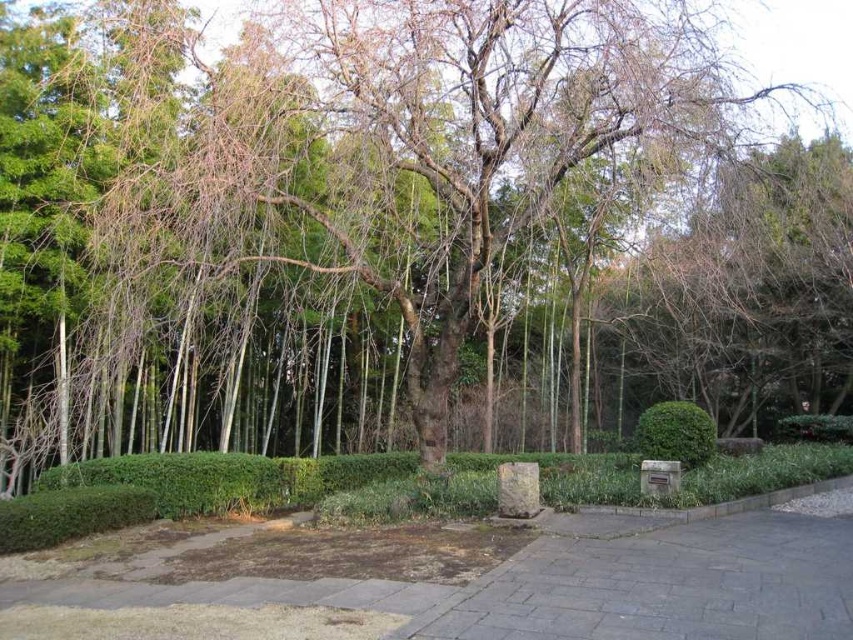
Question: Can you confirm if gray stone pavement at lower center is positioned to the right of green matte bush at center?

Choices:
 (A) no
 (B) yes

Answer: (A)

Question: Among these objects, which one is farthest from the camera?

Choices:
 (A) green matte bush at center
 (B) gray stone pavement at lower center

Answer: (A)

Question: Where is gray stone pavement at lower center located in relation to green matte bush at center in the image?

Choices:
 (A) above
 (B) below

Answer: (B)

Question: Can you confirm if gray stone pavement at lower center is smaller than green matte bush at center?

Choices:
 (A) yes
 (B) no

Answer: (A)